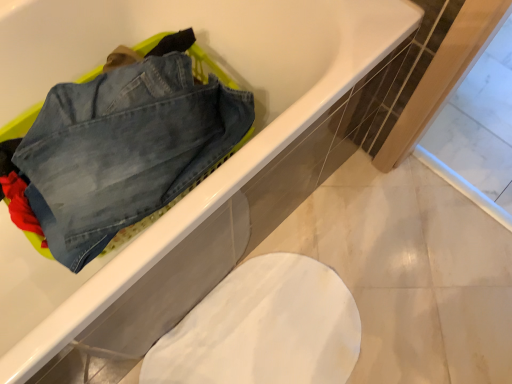
This screenshot has height=384, width=512. Describe the element at coordinates (124, 150) in the screenshot. I see `denim jeans at upper left` at that location.

Locate an element on the screen. This screenshot has width=512, height=384. denim jeans at upper left is located at coordinates (124, 150).

At what (x,y) coordinates should I click in order to perform the action: click on denim jeans at upper left. Please return your answer as a coordinate pair (x, y). The image size is (512, 384). Looking at the image, I should click on (124, 150).